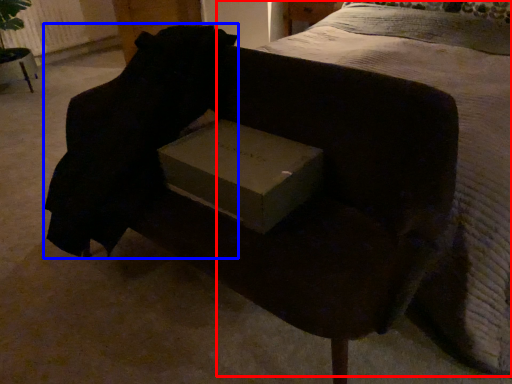
Question: Which object is closer to the camera taking this photo, bed (highlighted by a red box) or back (highlighted by a blue box)?

Choices:
 (A) bed
 (B) back

Answer: (A)